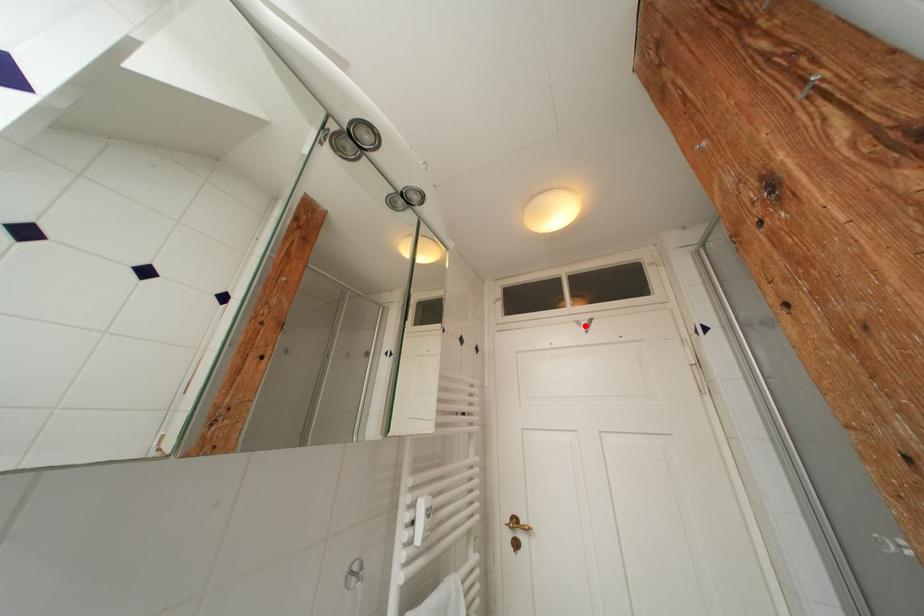
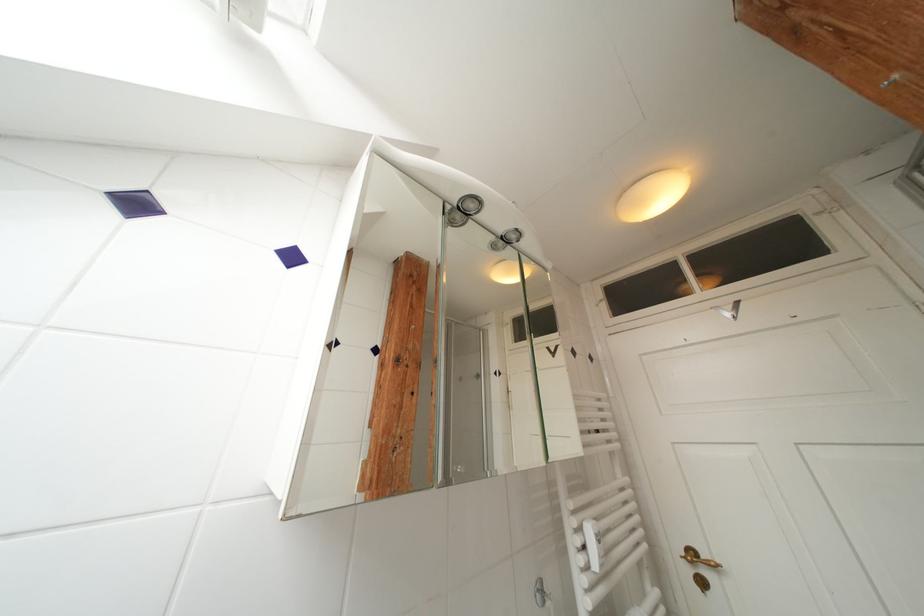
Question: I am providing you with two images of the same scene from different viewpoints. A red point is marked on the first image. Can you still see the location of the red point in image 2?

Choices:
 (A) Yes
 (B) No

Answer: (A)